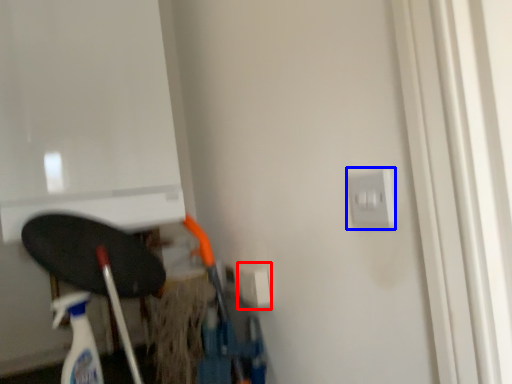
Question: Among these objects, which one is nearest to the camera, electric outlet (highlighted by a red box) or electric outlet (highlighted by a blue box)?

Choices:
 (A) electric outlet
 (B) electric outlet

Answer: (B)